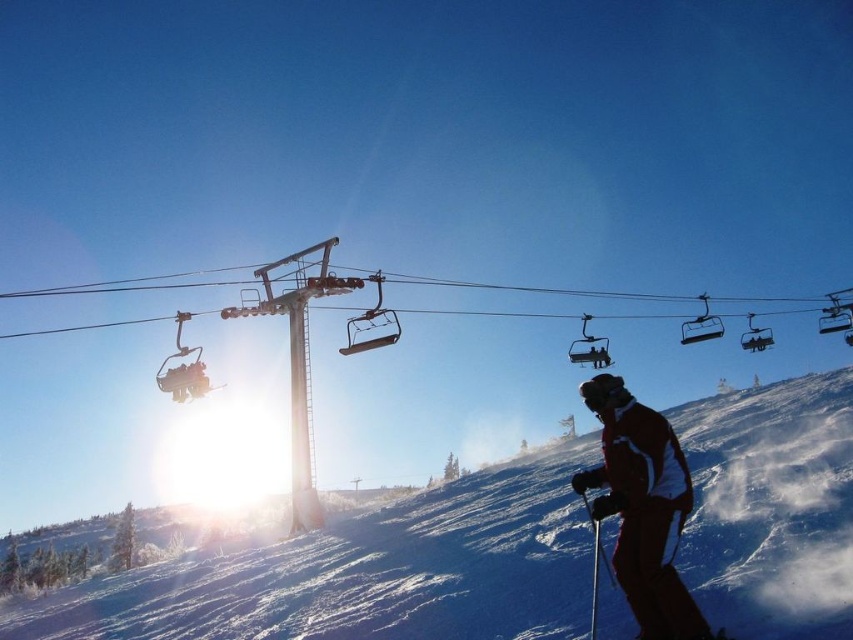
Question: Is red ski suit at lower right below metallic silver ski lift at upper center?

Choices:
 (A) yes
 (B) no

Answer: (A)

Question: Does white powdery snow at center appear under metallic silver ski lift at upper center?

Choices:
 (A) no
 (B) yes

Answer: (B)

Question: Does white powdery snow at center appear on the right side of metallic silver ski lift at upper center?

Choices:
 (A) yes
 (B) no

Answer: (A)

Question: Which point appears closest to the camera in this image?

Choices:
 (A) (38, 609)
 (B) (701, 630)

Answer: (B)

Question: Which point is closer to the camera?

Choices:
 (A) red ski suit at lower right
 (B) white powdery snow at center
 (C) metallic silver ski lift at upper center

Answer: (A)

Question: Which point is farther to the camera?

Choices:
 (A) white powdery snow at center
 (B) metallic silver ski lift at upper center
 (C) red ski suit at lower right

Answer: (B)